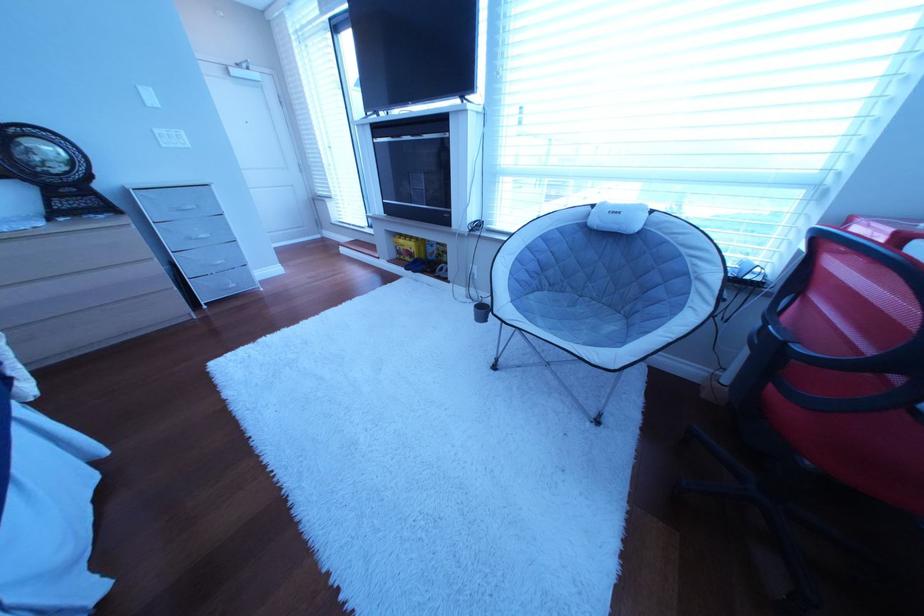
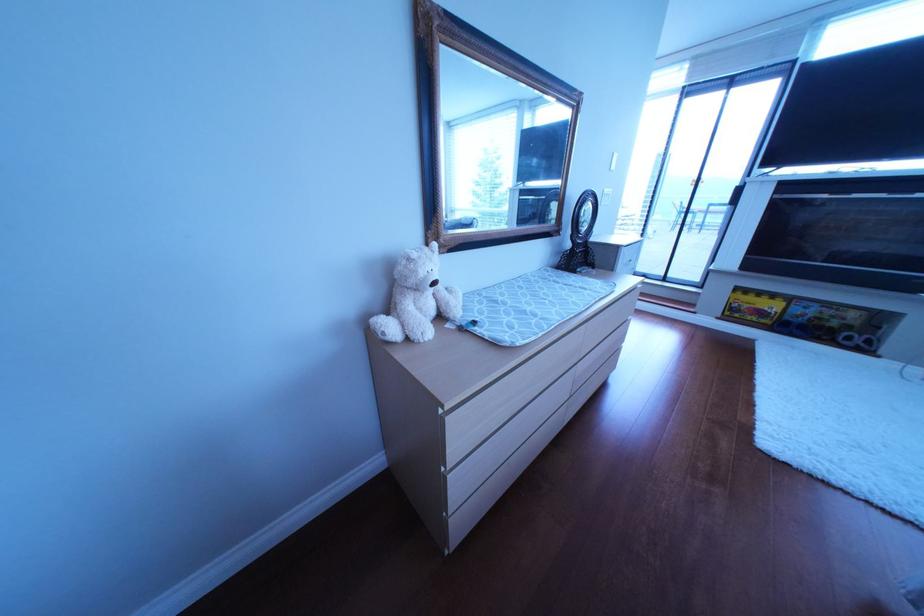
In the second image, find the point that corresponds to the point at 403,264 in the first image.

(733, 320)